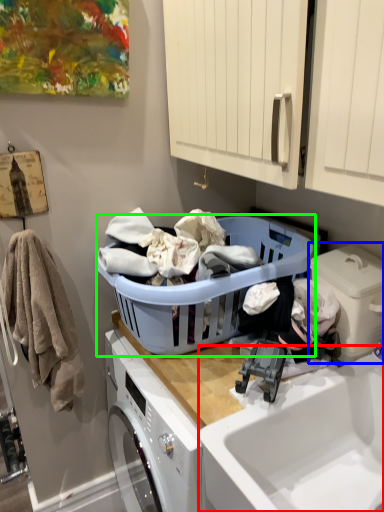
Question: Considering the real-world distances, which object is farthest from sink (highlighted by a red box)? washing machine (highlighted by a blue box) or laundry basket (highlighted by a green box)?

Choices:
 (A) washing machine
 (B) laundry basket

Answer: (B)